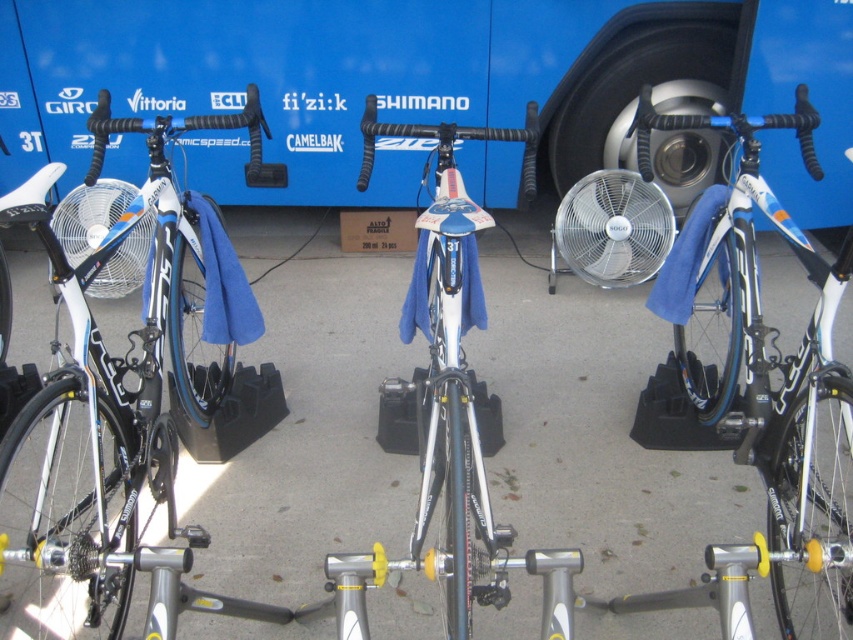
You are an interior designer planning to place a 1.2 meter wide shelf in the room. The shiny blue frame at left and the white plastic fan at left need to be placed on the shelf. Can both items fit side by side on the shelf without overlapping?

The shiny blue frame at left is wider than the white plastic fan at left. Since the shelf is 1.2 meters wide, both items can fit side by side as long as their combined width does not exceed the shelf length. However, without exact measurements of each item, it is impossible to confirm if they will fit perfectly.

You are standing in front of the bicycles and want to reach the point marked at coordinates point (776, 579). Considering the bicycles are 5.60 feet away from you, can you estimate how far you need to move forward to touch that point?

The point (776, 579) is 5.60 feet away from you, so you need to move forward approximately 5.60 feet to reach it.

You are a delivery person who needs to load both the shiny white bike at center and the shiny metallic bicycle at center into a truck. The truck has a loading ramp that can only accommodate one bicycle at a time. Based on their sizes, which bicycle should you load first to ensure the smaller one can fit through the ramp without obstruction?

The shiny metallic bicycle at center is smaller than the shiny white bike at center, so you should load the shiny metallic bicycle at center first to ensure it can fit through the ramp without obstruction before loading the larger shiny white bike at center.